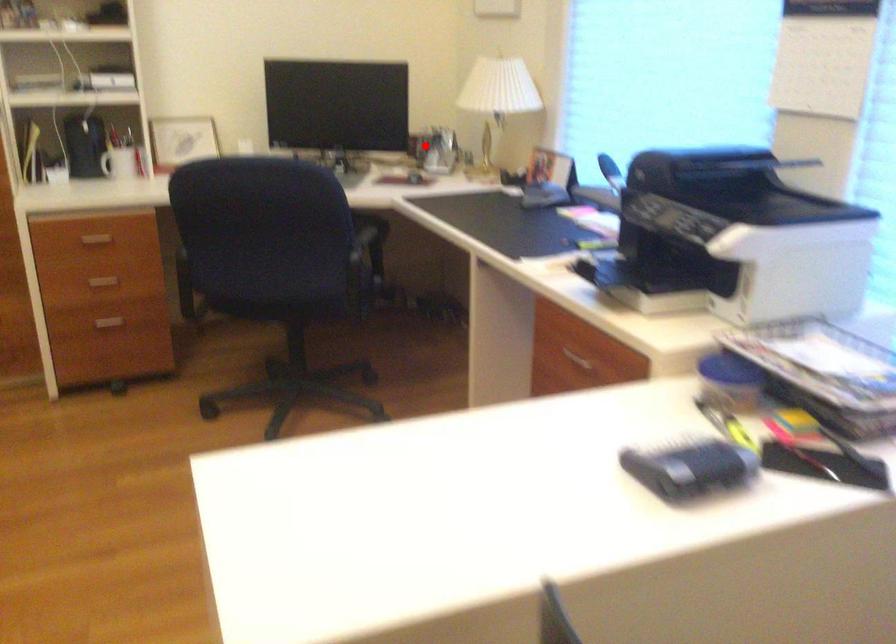
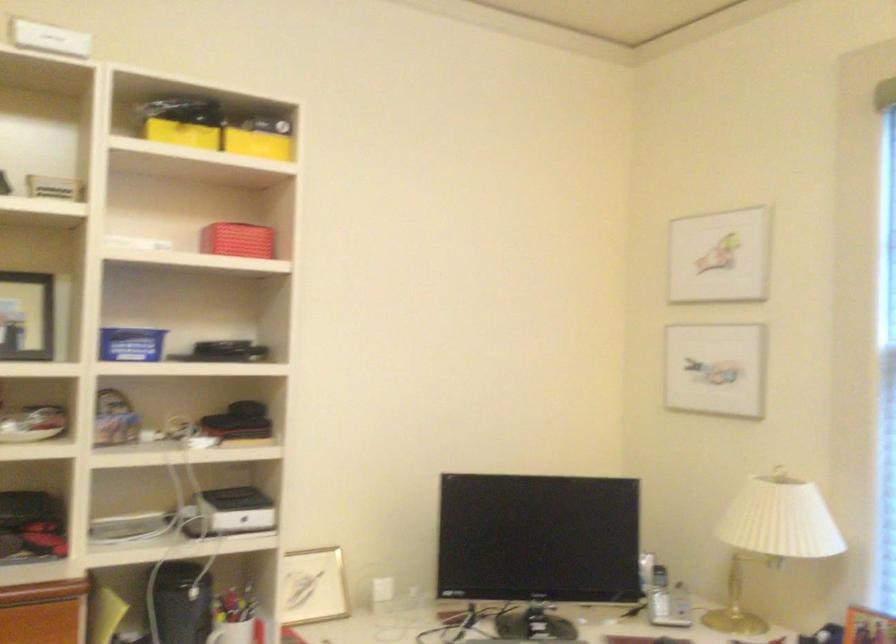
Question: I am providing you with two images of the same scene from different viewpoints. A red point is shown in image1. For the corresponding object point in image2, is it positioned nearer or farther from the camera?

Choices:
 (A) Nearer
 (B) Farther

Answer: (A)